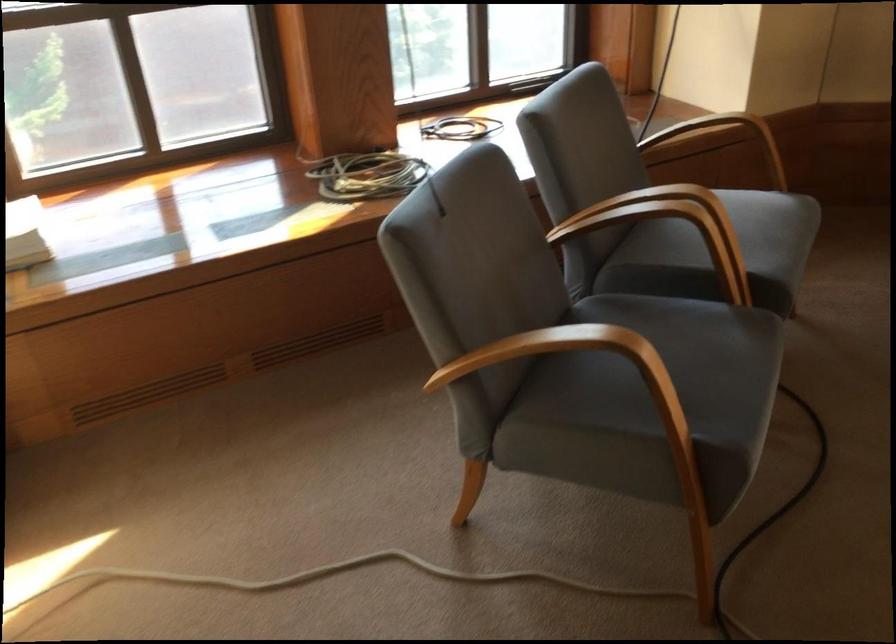
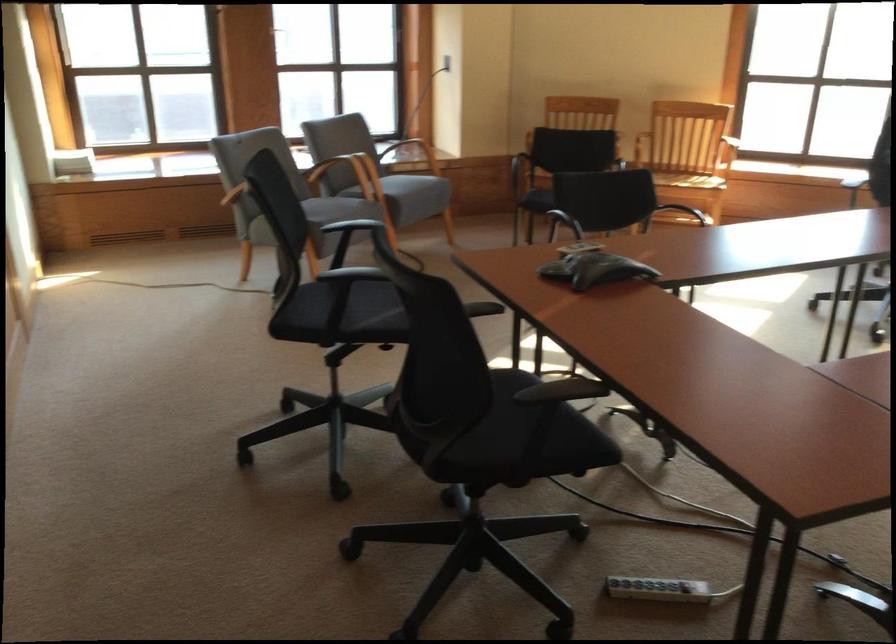
Question: I am providing you with two images of the same scene from different viewpoints. Please identify which objects are invisible in image2.

Choices:
 (A) wooden chair sitting surface
 (B) black chair sitting surface
 (C) wooden chair armrest
 (D) wooden bottle lid

Answer: (C)